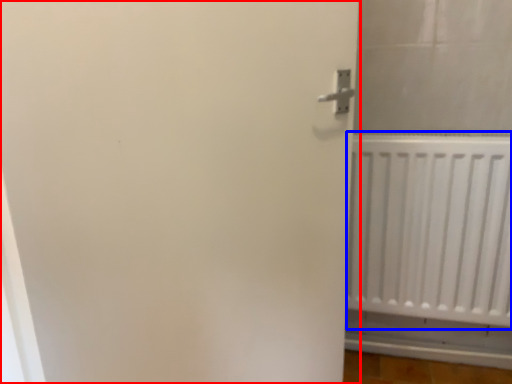
Question: Which of the following is the closest to the observer, door (highlighted by a red box) or radiator (highlighted by a blue box)?

Choices:
 (A) door
 (B) radiator

Answer: (A)